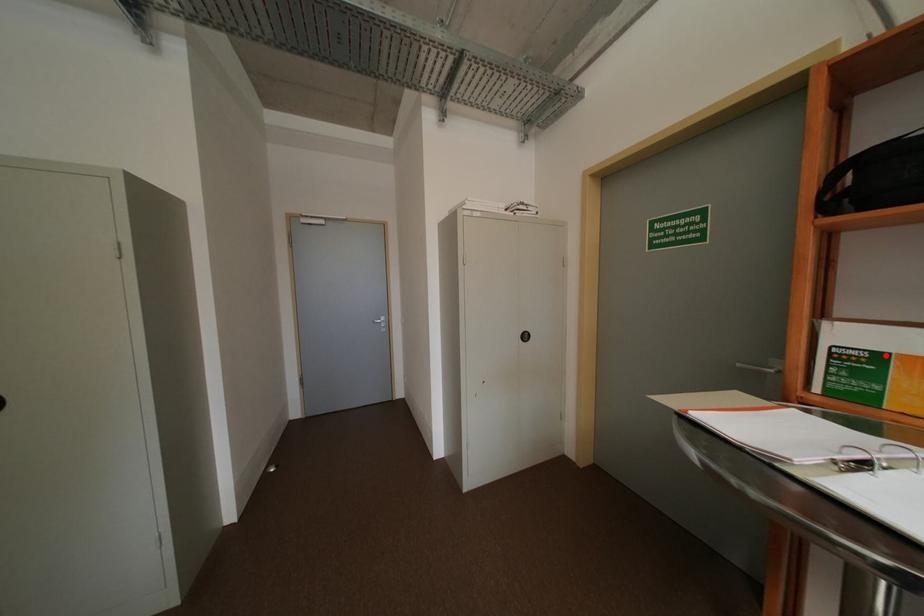
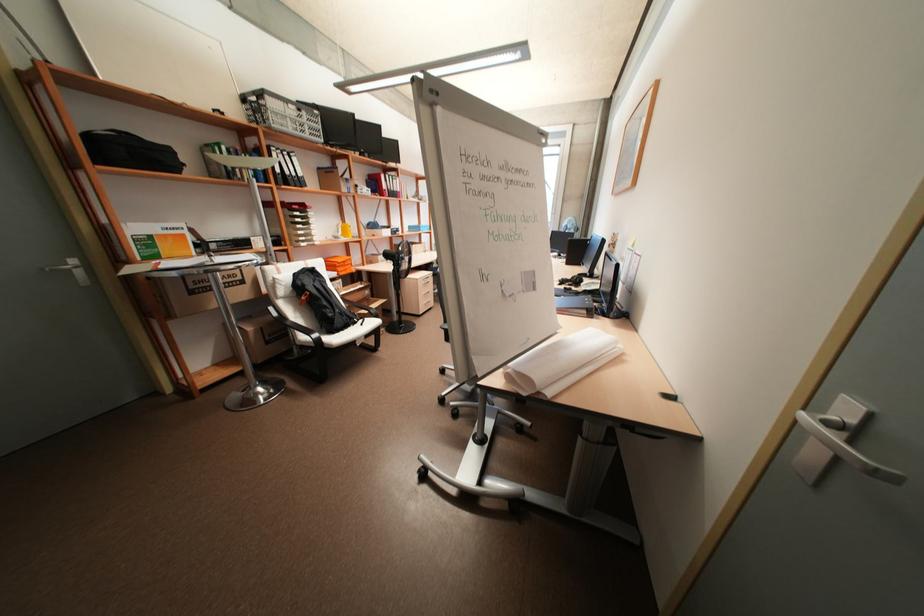
In the second image, find the point that corresponds to the highlighted location in the first image.

(155, 236)